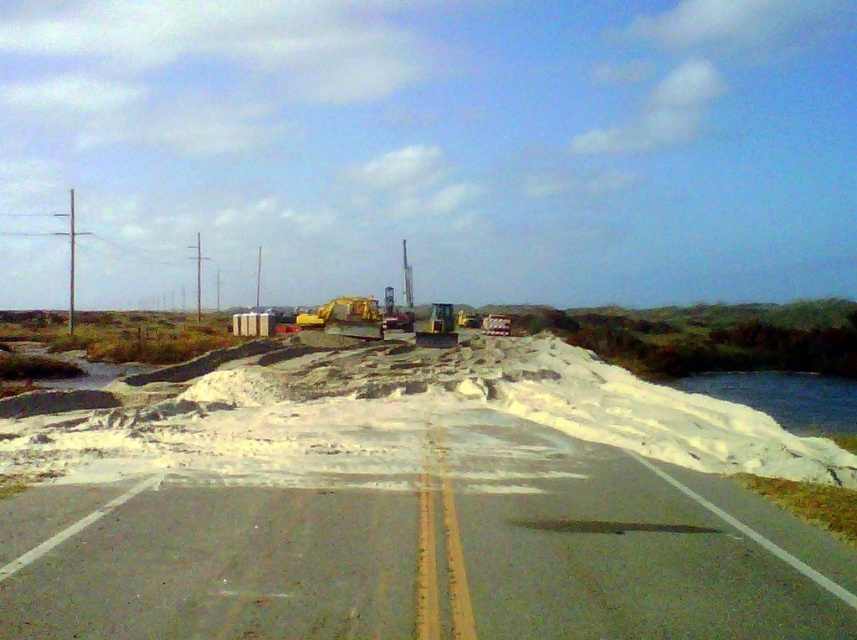
Question: Is gray asphalt highway at center thinner than white snow at lower right?

Choices:
 (A) no
 (B) yes

Answer: (B)

Question: Is gray asphalt highway at center further to the viewer compared to white snow at lower right?

Choices:
 (A) no
 (B) yes

Answer: (A)

Question: Which object is positioned closest to the yellow rubber tractor at center?

Choices:
 (A) white snow at lower right
 (B) gray asphalt highway at center

Answer: (A)

Question: Is gray asphalt highway at center smaller than white snow at lower right?

Choices:
 (A) no
 (B) yes

Answer: (B)

Question: Which point is farther to the camera?

Choices:
 (A) (823, 380)
 (B) (758, 616)
 (C) (304, 330)

Answer: (C)

Question: Which point is closer to the camera?

Choices:
 (A) (352, 300)
 (B) (796, 396)
 (C) (9, 541)

Answer: (C)